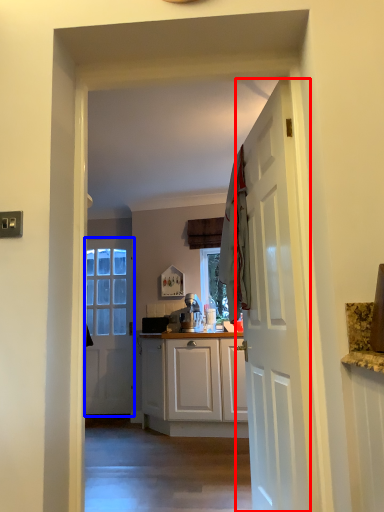
Question: Which point is further to the camera, door (highlighted by a red box) or door (highlighted by a blue box)?

Choices:
 (A) door
 (B) door

Answer: (B)